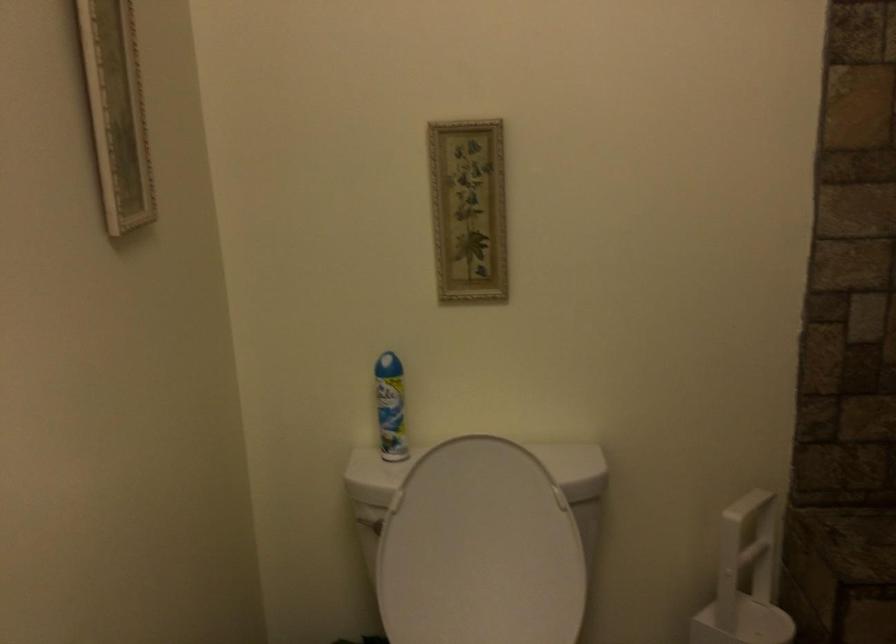
Image resolution: width=896 pixels, height=644 pixels. What do you see at coordinates (368, 522) in the screenshot?
I see `the toilet flush handle` at bounding box center [368, 522].